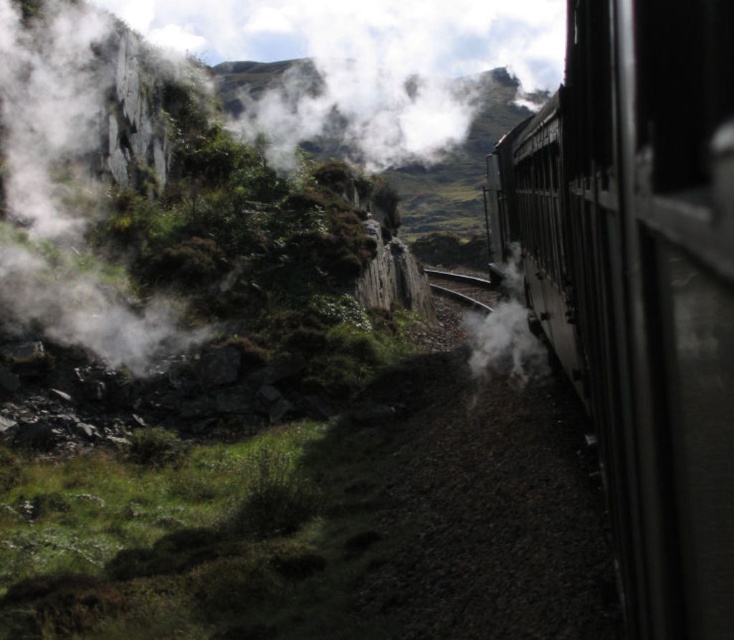
Does polished metal train at right have a smaller size compared to white foggy steam at left?

Correct, polished metal train at right occupies less space than white foggy steam at left.

Based on the photo, does polished metal train at right appear on the right side of white foggy steam at left?

Yes, polished metal train at right is to the right of white foggy steam at left.

Which is behind, point (633, 534) or point (12, 84)?

Point (12, 84)

This screenshot has width=734, height=640. Identify the location of polished metal train at right. (639, 284).